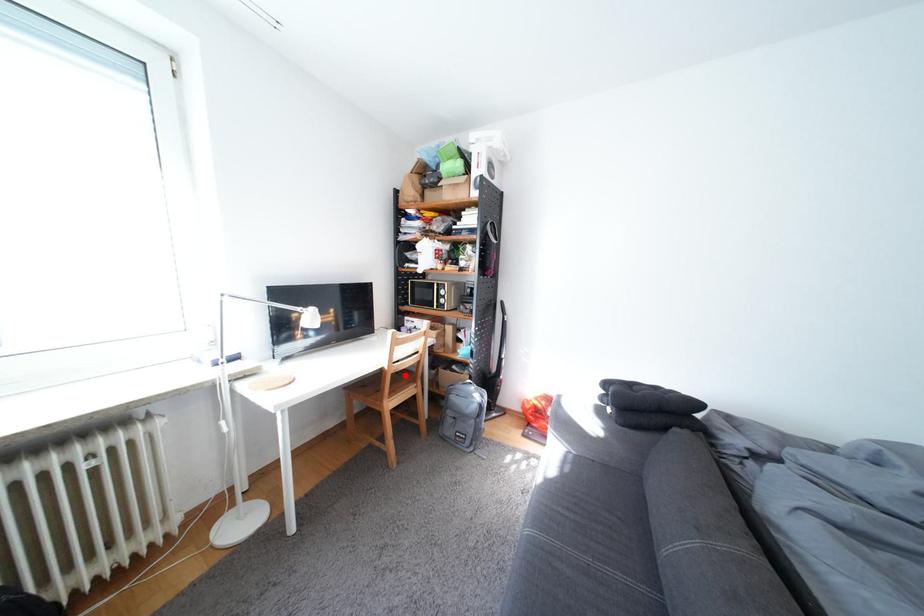
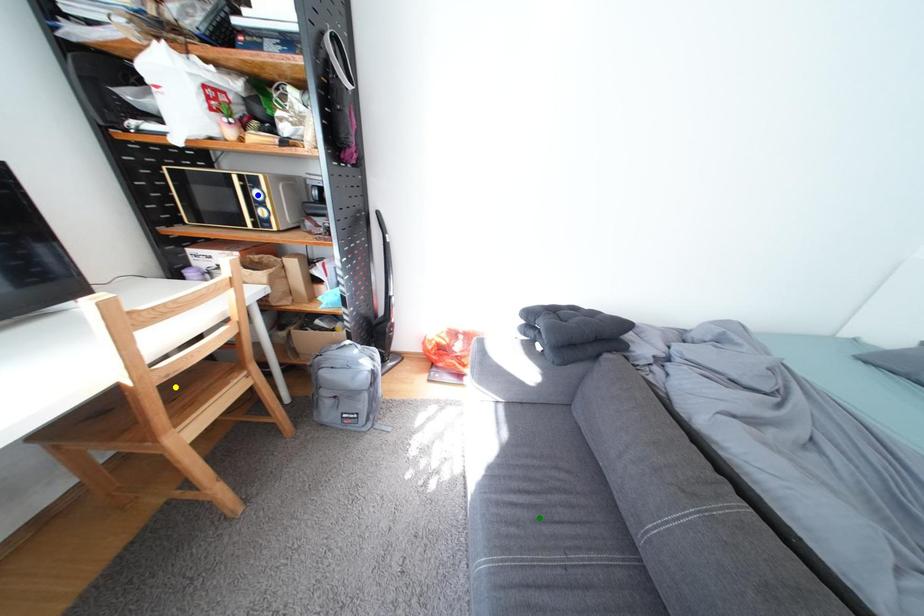
Question: I am providing you with two images of the same scene from different viewpoints. A red point is marked on the first image. You are given multiple points on the second image. In image 2, which mark is for the same physical point as the one in image 1?

Choices:
 (A) blue point
 (B) green point
 (C) yellow point

Answer: (C)